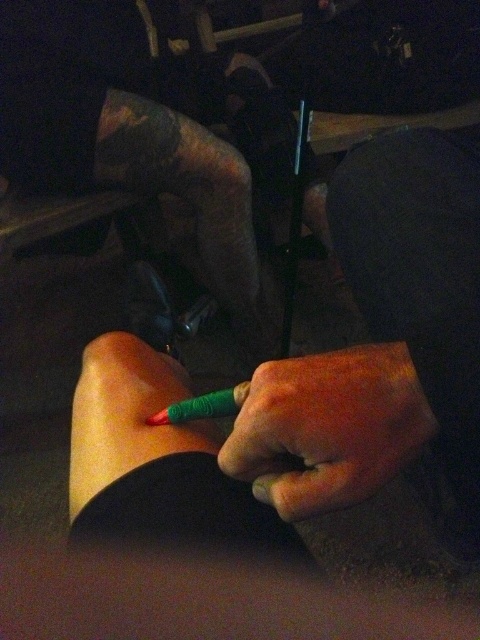
Question: Which of the following is the closest to the observer?

Choices:
 (A) (335, 372)
 (B) (200, 403)

Answer: (A)

Question: Observing the image, what is the correct spatial positioning of green matte pencil at lower left in reference to green matte pen at center?

Choices:
 (A) left
 (B) right

Answer: (A)

Question: Is green matte pencil at center bigger than green matte pencil at lower left?

Choices:
 (A) yes
 (B) no

Answer: (B)

Question: Which of the following is the farthest from the observer?

Choices:
 (A) green matte pen at center
 (B) green matte pencil at lower left
 (C) green matte pencil at center

Answer: (B)

Question: Estimate the real-world distances between objects in this image. Which object is farther from the green matte pencil at center?

Choices:
 (A) green matte pencil at lower left
 (B) green matte pen at center

Answer: (A)

Question: Does green matte pencil at lower left come behind green matte pen at center?

Choices:
 (A) yes
 (B) no

Answer: (A)